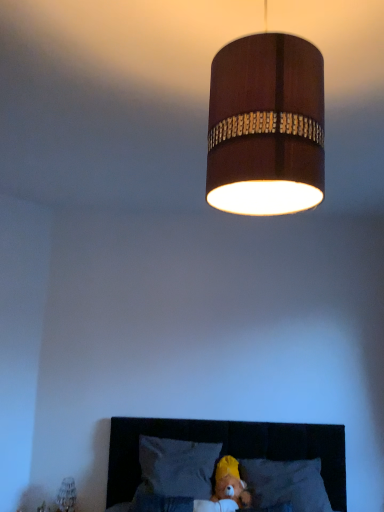
This screenshot has width=384, height=512. What do you see at coordinates (178, 466) in the screenshot?
I see `dark gray fabric pillow at lower center, acting as the 2th pillow starting from the right` at bounding box center [178, 466].

Measure the distance between wooden lampshade at upper center and camera.

wooden lampshade at upper center and camera are 63.91 centimeters apart.

Find the location of a particular element. velvet dark brown headboard at lower center is located at coordinates (229, 448).

Describe the element at coordinates (286, 483) in the screenshot. I see `gray fabric pillow at lower center, which appears as the first pillow when viewed from the right` at that location.

The image size is (384, 512). I want to click on wooden cylinder at upper center, so click(x=67, y=495).

This screenshot has width=384, height=512. I want to click on dark gray fabric pillow at lower center, which is counted as the first pillow, starting from the left, so click(178, 466).

From the picture: From the image's perspective, is gray fabric pillow at lower center, which appears as the first pillow when viewed from the right, positioned above or below wooden lampshade at upper center?

gray fabric pillow at lower center, which appears as the first pillow when viewed from the right, is below wooden lampshade at upper center.

Is gray fabric pillow at lower center, which appears as the first pillow when viewed from the right, outside of wooden lampshade at upper center?

Yes.

Based on the photo, how different are the orientations of gray fabric pillow at lower center, the 2th pillow viewed from the left, and wooden lampshade at upper center in degrees?

There is a 92.1-degree angle between the facing directions of gray fabric pillow at lower center, the 2th pillow viewed from the left, and wooden lampshade at upper center.

Considering the positions of point (296, 499) and point (209, 121), is point (296, 499) closer or farther from the camera than point (209, 121)?

Point (296, 499) is positioned farther from the camera compared to point (209, 121).

Considering the sizes of wooden lampshade at upper center and gray fabric pillow at lower center, which appears as the first pillow when viewed from the right, in the image, is wooden lampshade at upper center wider or thinner than gray fabric pillow at lower center, which appears as the first pillow when viewed from the right,?

wooden lampshade at upper center is thinner than gray fabric pillow at lower center, which appears as the first pillow when viewed from the right.

Is wooden lampshade at upper center located outside gray fabric pillow at lower center, which appears as the first pillow when viewed from the right?

Yes, wooden lampshade at upper center is not within gray fabric pillow at lower center, which appears as the first pillow when viewed from the right.

From a real-world perspective, which object rests below the other?

From a 3D spatial view, gray fabric pillow at lower center, which appears as the first pillow when viewed from the right, is below.

Is wooden lampshade at upper center positioned with its back to gray fabric pillow at lower center, the 2th pillow viewed from the left?

No, wooden lampshade at upper center is not facing the opposite direction of gray fabric pillow at lower center, the 2th pillow viewed from the left.

Is the surface of velvet dark brown headboard at lower center in direct contact with wooden cylinder at upper center?

No, velvet dark brown headboard at lower center is not beside wooden cylinder at upper center.

From a real-world perspective, which is physically above, velvet dark brown headboard at lower center or wooden cylinder at upper center?

velvet dark brown headboard at lower center.

Considering the relative positions of velvet dark brown headboard at lower center and wooden cylinder at upper center in the image provided, is velvet dark brown headboard at lower center to the right of wooden cylinder at upper center from the viewer's perspective?

Indeed, velvet dark brown headboard at lower center is positioned on the right side of wooden cylinder at upper center.

Which of these two, gray fabric pillow at lower center, which appears as the first pillow when viewed from the right, or velvet dark brown headboard at lower center, stands shorter?

With less height is gray fabric pillow at lower center, which appears as the first pillow when viewed from the right.

Does gray fabric pillow at lower center, the 2th pillow viewed from the left, have a greater width compared to velvet dark brown headboard at lower center?

In fact, gray fabric pillow at lower center, the 2th pillow viewed from the left, might be narrower than velvet dark brown headboard at lower center.

From a real-world perspective, is gray fabric pillow at lower center, the 2th pillow viewed from the left, positioned under velvet dark brown headboard at lower center based on gravity?

Indeed, from a real-world perspective, gray fabric pillow at lower center, the 2th pillow viewed from the left, is positioned beneath velvet dark brown headboard at lower center.

Considering the positions of point (275, 461) and point (261, 444), is point (275, 461) closer or farther from the camera than point (261, 444)?

Point (275, 461) appears to be closer to the viewer than point (261, 444).

Does point (65, 496) appear closer or farther from the camera than point (208, 477)?

Point (65, 496).

Based on the photo, is dark gray fabric pillow at lower center, acting as the 2th pillow starting from the right, at the back of wooden cylinder at upper center?

That's not correct — wooden cylinder at upper center is not looking away from dark gray fabric pillow at lower center, acting as the 2th pillow starting from the right.

Can you confirm if wooden cylinder at upper center is taller than dark gray fabric pillow at lower center, which is counted as the first pillow, starting from the left?

No, wooden cylinder at upper center is not taller than dark gray fabric pillow at lower center, which is counted as the first pillow, starting from the left.

Based on the photo, which object is positioned more to the left, wooden cylinder at upper center or dark gray fabric pillow at lower center, which is counted as the first pillow, starting from the left?

Positioned to the left is wooden cylinder at upper center.

Which object is positioned more to the right, dark gray fabric pillow at lower center, which is counted as the first pillow, starting from the left, or gray fabric pillow at lower center, which appears as the first pillow when viewed from the right?

Positioned to the right is gray fabric pillow at lower center, which appears as the first pillow when viewed from the right.

From the image's perspective, is dark gray fabric pillow at lower center, which is counted as the first pillow, starting from the left, beneath gray fabric pillow at lower center, which appears as the first pillow when viewed from the right?

No.

Does dark gray fabric pillow at lower center, which is counted as the first pillow, starting from the left, lie behind gray fabric pillow at lower center, the 2th pillow viewed from the left?

That is True.

In the image, there is a dark gray fabric pillow at lower center, acting as the 2th pillow starting from the right. Where is `pillow below it (from a real-world perspective)`? The width and height of the screenshot is (384, 512). pillow below it (from a real-world perspective) is located at coordinates (286, 483).

From the image's perspective, which is above, dark gray fabric pillow at lower center, which is counted as the first pillow, starting from the left, or wooden lampshade at upper center?

wooden lampshade at upper center, from the image's perspective.

Is dark gray fabric pillow at lower center, which is counted as the first pillow, starting from the left, positioned with its back to wooden lampshade at upper center?

No, dark gray fabric pillow at lower center, which is counted as the first pillow, starting from the left, is not facing away from wooden lampshade at upper center.

Identify the location of lamp located above the dark gray fabric pillow at lower center, which is counted as the first pillow, starting from the left (from the image's perspective). (266, 126).

Which is closer to the camera, [189,489] or [216,63]?

Point [189,489].

You are a GUI agent. You are given a task and a screenshot of the screen. Output one action in this format:
    pyautogui.click(x=<x>, y=<y>)
    Task: Click on the pillow on the right of wooden lampshade at upper center
    The width and height of the screenshot is (384, 512).
    Given the screenshot: What is the action you would take?
    pyautogui.click(x=286, y=483)

You are a GUI agent. You are given a task and a screenshot of the screen. Output one action in this format:
    pyautogui.click(x=<x>, y=<y>)
    Task: Click on the lamp on the left of the gray fabric pillow at lower center, which appears as the first pillow when viewed from the right
    This screenshot has width=384, height=512.
    Given the screenshot: What is the action you would take?
    pyautogui.click(x=266, y=126)

From the image, which object appears to be nearer to gray fabric pillow at lower center, the 2th pillow viewed from the left, velvet dark brown headboard at lower center or yellow plush at lower center?

yellow plush at lower center is closer to gray fabric pillow at lower center, the 2th pillow viewed from the left.

From the image, which object appears to be farther from gray fabric pillow at lower center, which appears as the first pillow when viewed from the right, dark gray fabric pillow at lower center, acting as the 2th pillow starting from the right, or wooden cylinder at upper center?

Based on the image, wooden cylinder at upper center appears to be further to gray fabric pillow at lower center, which appears as the first pillow when viewed from the right.

Which object lies nearer to the anchor point velvet dark brown headboard at lower center, dark gray fabric pillow at lower center, which is counted as the first pillow, starting from the left, or wooden lampshade at upper center?

dark gray fabric pillow at lower center, which is counted as the first pillow, starting from the left, lies closer to velvet dark brown headboard at lower center than the other object.

In the scene shown: When comparing their distances from gray fabric pillow at lower center, which appears as the first pillow when viewed from the right, does wooden cylinder at upper center or wooden lampshade at upper center seem further?

wooden lampshade at upper center is further to gray fabric pillow at lower center, which appears as the first pillow when viewed from the right.

Considering their positions, is wooden lampshade at upper center positioned further to wooden cylinder at upper center than velvet dark brown headboard at lower center?

wooden lampshade at upper center lies further to wooden cylinder at upper center than the other object.

Looking at the image, which one is located closer to gray fabric pillow at lower center, the 2th pillow viewed from the left, wooden lampshade at upper center or yellow plush at lower center?

Among the two, yellow plush at lower center is located nearer to gray fabric pillow at lower center, the 2th pillow viewed from the left.

Looking at the image, which one is located closer to gray fabric pillow at lower center, which appears as the first pillow when viewed from the right, velvet dark brown headboard at lower center or dark gray fabric pillow at lower center, acting as the 2th pillow starting from the right?

The object closer to gray fabric pillow at lower center, which appears as the first pillow when viewed from the right, is velvet dark brown headboard at lower center.

Considering their positions, is velvet dark brown headboard at lower center positioned closer to dark gray fabric pillow at lower center, which is counted as the first pillow, starting from the left, than wooden cylinder at upper center?

Based on the image, velvet dark brown headboard at lower center appears to be nearer to dark gray fabric pillow at lower center, which is counted as the first pillow, starting from the left.

You are a GUI agent. You are given a task and a screenshot of the screen. Output one action in this format:
    pyautogui.click(x=<x>, y=<y>)
    Task: Click on the furniture between wooden lampshade at upper center and yellow plush at lower center from top to bottom
    The height and width of the screenshot is (512, 384).
    Given the screenshot: What is the action you would take?
    pyautogui.click(x=229, y=448)

Where is `head positioned between velvet dark brown headboard at lower center and wooden cylinder at upper center from near to far`? Image resolution: width=384 pixels, height=512 pixels. head positioned between velvet dark brown headboard at lower center and wooden cylinder at upper center from near to far is located at coordinates (230, 483).

Identify the location of furniture between wooden lampshade at upper center and dark gray fabric pillow at lower center, which is counted as the first pillow, starting from the left, in the up-down direction. This screenshot has width=384, height=512. (229, 448).

Where is `pillow situated between wooden cylinder at upper center and gray fabric pillow at lower center, the 2th pillow viewed from the left, from left to right`? The image size is (384, 512). pillow situated between wooden cylinder at upper center and gray fabric pillow at lower center, the 2th pillow viewed from the left, from left to right is located at coordinates (178, 466).